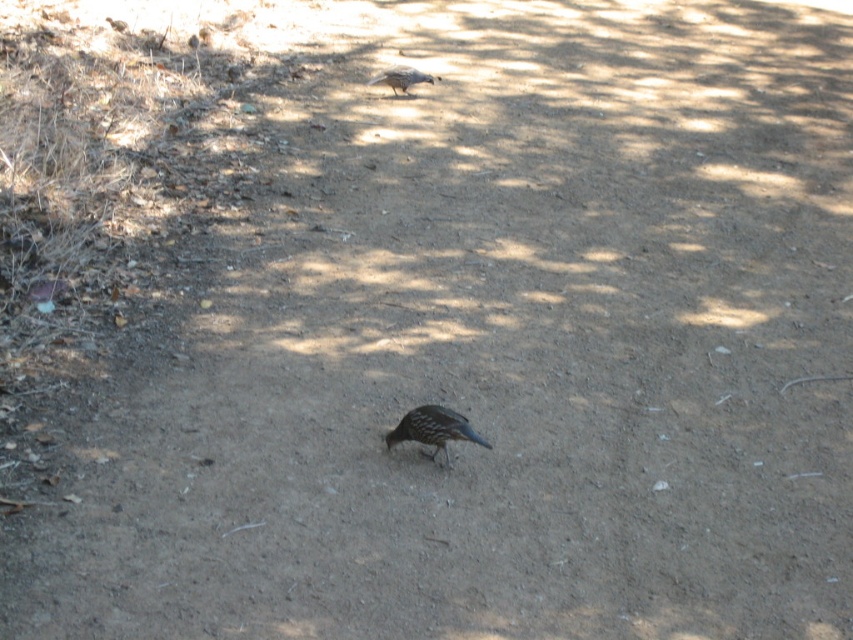
Identify the location of blue glossy bird at center. point(433,429).

Is blue glossy bird at center further to the viewer compared to brown speckled bird at upper center?

No, blue glossy bird at center is closer to the viewer.

Is point (450, 432) behind point (415, 77)?

No, it is not.

Locate an element on the screen. The height and width of the screenshot is (640, 853). blue glossy bird at center is located at coordinates (433, 429).